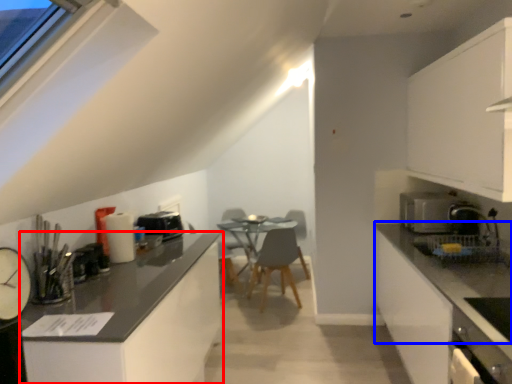
Question: Which of the following is the farthest to the observer, cabinetry (highlighted by a red box) or countertop (highlighted by a blue box)?

Choices:
 (A) cabinetry
 (B) countertop

Answer: (A)